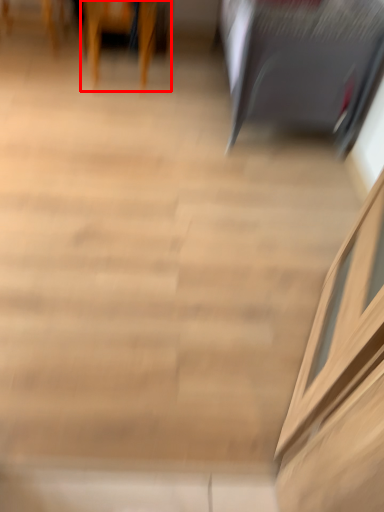
Question: From the image's perspective, what is the correct spatial relationship of furniture (annotated by the red box) in relation to furniture?

Choices:
 (A) below
 (B) above

Answer: (B)